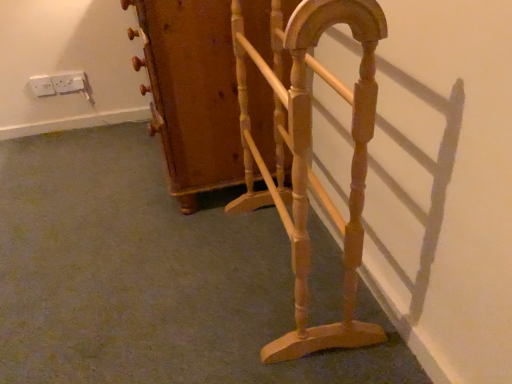
What is the approximate height of light brown wood magazine rack at center, the first furniture when ordered from front to back?

light brown wood magazine rack at center, the first furniture when ordered from front to back, is 29.65 inches in height.

This screenshot has width=512, height=384. What do you see at coordinates (69, 82) in the screenshot?
I see `white plastic socket at upper left, which is the 2th electric outlet in left-to-right order` at bounding box center [69, 82].

What is the approximate width of white plastic socket at upper left, which is the 2th electric outlet in right-to-left order?

0.84 inches.

Describe the element at coordinates (42, 86) in the screenshot. The image size is (512, 384). I see `white plastic socket at upper left, which is the 2th electric outlet in right-to-left order` at that location.

Find the location of a particular element. wooden coat rack at center, the 2th furniture in the front-to-back sequence is located at coordinates (192, 93).

Is light brown wood magazine rack at center, the first furniture when ordered from front to back, at the right side of white plastic socket at upper left, which is the 2th electric outlet in right-to-left order?

Yes, light brown wood magazine rack at center, the first furniture when ordered from front to back, is to the right of white plastic socket at upper left, which is the 2th electric outlet in right-to-left order.

Could you measure the distance between light brown wood magazine rack at center, which is counted as the 2th furniture, starting from the back, and white plastic socket at upper left, which is counted as the first electric outlet, starting from the left?

The distance of light brown wood magazine rack at center, which is counted as the 2th furniture, starting from the back, from white plastic socket at upper left, which is counted as the first electric outlet, starting from the left, is 4.98 feet.

Does light brown wood magazine rack at center, the first furniture when ordered from front to back, have a lesser height compared to white plastic socket at upper left, which is the 2th electric outlet in right-to-left order?

In fact, light brown wood magazine rack at center, the first furniture when ordered from front to back, may be taller than white plastic socket at upper left, which is the 2th electric outlet in right-to-left order.

Is point (296, 55) positioned in front of point (32, 90)?

Yes, point (296, 55) is closer to viewer.

Looking at this image, is light brown wood magazine rack at center, which is counted as the 2th furniture, starting from the back, bigger than wooden coat rack at center, the 2th furniture in the front-to-back sequence?

Actually, light brown wood magazine rack at center, which is counted as the 2th furniture, starting from the back, might be smaller than wooden coat rack at center, the 2th furniture in the front-to-back sequence.

Between point (360, 229) and point (260, 19), which one is positioned in front?

The point (360, 229) is closer to the camera.

Can you confirm if light brown wood magazine rack at center, the first furniture when ordered from front to back, is thinner than wooden coat rack at center, positioned as the 1th furniture in back-to-front order?

Indeed, light brown wood magazine rack at center, the first furniture when ordered from front to back, has a lesser width compared to wooden coat rack at center, positioned as the 1th furniture in back-to-front order.

Can you tell me how much light brown wood magazine rack at center, the first furniture when ordered from front to back, and wooden coat rack at center, the 2th furniture in the front-to-back sequence, differ in facing direction?

The angular difference between light brown wood magazine rack at center, the first furniture when ordered from front to back, and wooden coat rack at center, the 2th furniture in the front-to-back sequence, is 5.45 degrees.

Where is `furniture that is the 2nd one when counting rightward from the white plastic socket at upper left, which is the 2th electric outlet in left-to-right order`? The height and width of the screenshot is (384, 512). furniture that is the 2nd one when counting rightward from the white plastic socket at upper left, which is the 2th electric outlet in left-to-right order is located at coordinates (308, 155).

Looking at this image, is white plastic socket at upper left, the first electric outlet in the right-to-left sequence, positioned with its back to light brown wood magazine rack at center, which is counted as the 2th furniture, starting from the back?

white plastic socket at upper left, the first electric outlet in the right-to-left sequence, is not turned away from light brown wood magazine rack at center, which is counted as the 2th furniture, starting from the back.

Is white plastic socket at upper left, which is the 2th electric outlet in left-to-right order, touching light brown wood magazine rack at center, the first furniture when ordered from front to back?

They are not placed beside each other.

Between white plastic socket at upper left, which is the 2th electric outlet in left-to-right order, and light brown wood magazine rack at center, which is counted as the 2th furniture, starting from the back, which one has larger width?

With larger width is light brown wood magazine rack at center, which is counted as the 2th furniture, starting from the back.

From the image's perspective, is white plastic socket at upper left, which is counted as the first electric outlet, starting from the left, on top of white plastic socket at upper left, the first electric outlet in the right-to-left sequence?

No, from the image's perspective, white plastic socket at upper left, which is counted as the first electric outlet, starting from the left, is not over white plastic socket at upper left, the first electric outlet in the right-to-left sequence.

Consider the image. Would you consider white plastic socket at upper left, which is the 2th electric outlet in right-to-left order, to be distant from white plastic socket at upper left, the first electric outlet in the right-to-left sequence?

That's not correct — white plastic socket at upper left, which is the 2th electric outlet in right-to-left order, is a little close to white plastic socket at upper left, the first electric outlet in the right-to-left sequence.

Between white plastic socket at upper left, which is the 2th electric outlet in right-to-left order, and white plastic socket at upper left, which is the 2th electric outlet in left-to-right order, which one has smaller width?

Thinner between the two is white plastic socket at upper left, which is the 2th electric outlet in right-to-left order.

Does white plastic socket at upper left, which is the 2th electric outlet in left-to-right order, have a smaller size compared to white plastic socket at upper left, which is the 2th electric outlet in right-to-left order?

Actually, white plastic socket at upper left, which is the 2th electric outlet in left-to-right order, might be larger than white plastic socket at upper left, which is the 2th electric outlet in right-to-left order.

Between white plastic socket at upper left, the first electric outlet in the right-to-left sequence, and white plastic socket at upper left, which is counted as the first electric outlet, starting from the left, which one appears on the left side from the viewer's perspective?

From the viewer's perspective, white plastic socket at upper left, which is counted as the first electric outlet, starting from the left, appears more on the left side.

Can you tell me how much white plastic socket at upper left, which is the 2th electric outlet in left-to-right order, and white plastic socket at upper left, which is counted as the first electric outlet, starting from the left, differ in facing direction?

The angle between the facing direction of white plastic socket at upper left, which is the 2th electric outlet in left-to-right order, and the facing direction of white plastic socket at upper left, which is counted as the first electric outlet, starting from the left, is 0.00368 degrees.

In the scene shown: Which is closer, [57,87] or [36,78]?

Clearly, point [57,87] is more distant from the camera than point [36,78].

Is wooden coat rack at center, the 2th furniture in the front-to-back sequence, to the left or to the right of white plastic socket at upper left, the first electric outlet in the right-to-left sequence, in the image?

wooden coat rack at center, the 2th furniture in the front-to-back sequence, is positioned on white plastic socket at upper left, the first electric outlet in the right-to-left sequence,'s right side.

Can you confirm if wooden coat rack at center, the 2th furniture in the front-to-back sequence, is wider than white plastic socket at upper left, the first electric outlet in the right-to-left sequence?

Indeed, wooden coat rack at center, the 2th furniture in the front-to-back sequence, has a greater width compared to white plastic socket at upper left, the first electric outlet in the right-to-left sequence.

Considering the sizes of objects wooden coat rack at center, positioned as the 1th furniture in back-to-front order, and white plastic socket at upper left, the first electric outlet in the right-to-left sequence, in the image provided, who is shorter, wooden coat rack at center, positioned as the 1th furniture in back-to-front order, or white plastic socket at upper left, the first electric outlet in the right-to-left sequence,?

With less height is white plastic socket at upper left, the first electric outlet in the right-to-left sequence.

Which is behind, point (202, 58) or point (76, 74)?

Positioned behind is point (76, 74).

Which point is more forward, (49, 87) or (357, 176)?

The point (357, 176) is more forward.

Is white plastic socket at upper left, which is counted as the first electric outlet, starting from the left, next to light brown wood magazine rack at center, the first furniture when ordered from front to back, and touching it?

No, white plastic socket at upper left, which is counted as the first electric outlet, starting from the left, is not beside light brown wood magazine rack at center, the first furniture when ordered from front to back.

How different are the orientations of white plastic socket at upper left, which is the 2th electric outlet in right-to-left order, and light brown wood magazine rack at center, which is counted as the 2th furniture, starting from the back, in degrees?

The facing directions of white plastic socket at upper left, which is the 2th electric outlet in right-to-left order, and light brown wood magazine rack at center, which is counted as the 2th furniture, starting from the back, are 93.8 degrees apart.

Is white plastic socket at upper left, which is counted as the first electric outlet, starting from the left, facing away from light brown wood magazine rack at center, which is counted as the 2th furniture, starting from the back?

No.

Which furniture is the 2nd one when counting from the right side of the white plastic socket at upper left, which is counted as the first electric outlet, starting from the left? Please provide its 2D coordinates.

[(308, 155)]

This screenshot has width=512, height=384. In order to click on furniture located in front of the wooden coat rack at center, the 2th furniture in the front-to-back sequence in this screenshot , I will do `click(308, 155)`.

From the picture: Based on their spatial positions, is white plastic socket at upper left, which is counted as the first electric outlet, starting from the left, or wooden coat rack at center, positioned as the 1th furniture in back-to-front order, further from white plastic socket at upper left, which is the 2th electric outlet in left-to-right order?

Among the two, wooden coat rack at center, positioned as the 1th furniture in back-to-front order, is located further to white plastic socket at upper left, which is the 2th electric outlet in left-to-right order.

When comparing their distances from white plastic socket at upper left, which is counted as the first electric outlet, starting from the left, does light brown wood magazine rack at center, which is counted as the 2th furniture, starting from the back, or wooden coat rack at center, positioned as the 1th furniture in back-to-front order, seem closer?

Among the two, wooden coat rack at center, positioned as the 1th furniture in back-to-front order, is located nearer to white plastic socket at upper left, which is counted as the first electric outlet, starting from the left.

When comparing their distances from white plastic socket at upper left, which is counted as the first electric outlet, starting from the left, does wooden coat rack at center, positioned as the 1th furniture in back-to-front order, or light brown wood magazine rack at center, the first furniture when ordered from front to back, seem further?

Among the two, light brown wood magazine rack at center, the first furniture when ordered from front to back, is located further to white plastic socket at upper left, which is counted as the first electric outlet, starting from the left.

Looking at the image, which one is located closer to white plastic socket at upper left, which is counted as the first electric outlet, starting from the left, white plastic socket at upper left, which is the 2th electric outlet in left-to-right order, or light brown wood magazine rack at center, the first furniture when ordered from front to back?

white plastic socket at upper left, which is the 2th electric outlet in left-to-right order, is positioned closer to the anchor white plastic socket at upper left, which is counted as the first electric outlet, starting from the left.

Which object lies nearer to the anchor point white plastic socket at upper left, the first electric outlet in the right-to-left sequence, light brown wood magazine rack at center, the first furniture when ordered from front to back, or white plastic socket at upper left, which is counted as the first electric outlet, starting from the left?

white plastic socket at upper left, which is counted as the first electric outlet, starting from the left, is positioned closer to the anchor white plastic socket at upper left, the first electric outlet in the right-to-left sequence.

When comparing their distances from wooden coat rack at center, the 2th furniture in the front-to-back sequence, does white plastic socket at upper left, the first electric outlet in the right-to-left sequence, or white plastic socket at upper left, which is the 2th electric outlet in right-to-left order, seem further?

Among the two, white plastic socket at upper left, which is the 2th electric outlet in right-to-left order, is located further to wooden coat rack at center, the 2th furniture in the front-to-back sequence.

Based on their spatial positions, is wooden coat rack at center, positioned as the 1th furniture in back-to-front order, or white plastic socket at upper left, which is the 2th electric outlet in left-to-right order, further from white plastic socket at upper left, which is the 2th electric outlet in right-to-left order?

The object further to white plastic socket at upper left, which is the 2th electric outlet in right-to-left order, is wooden coat rack at center, positioned as the 1th furniture in back-to-front order.

Looking at the image, which one is located closer to light brown wood magazine rack at center, which is counted as the 2th furniture, starting from the back, wooden coat rack at center, positioned as the 1th furniture in back-to-front order, or white plastic socket at upper left, the first electric outlet in the right-to-left sequence?

The object closer to light brown wood magazine rack at center, which is counted as the 2th furniture, starting from the back, is wooden coat rack at center, positioned as the 1th furniture in back-to-front order.

Identify the location of electric outlet between light brown wood magazine rack at center, the first furniture when ordered from front to back, and white plastic socket at upper left, which is the 2th electric outlet in left-to-right order, in the front-back direction. (42, 86).

Image resolution: width=512 pixels, height=384 pixels. What are the coordinates of `furniture located between light brown wood magazine rack at center, which is counted as the 2th furniture, starting from the back, and white plastic socket at upper left, which is the 2th electric outlet in right-to-left order, in the depth direction` in the screenshot? It's located at (192, 93).

Image resolution: width=512 pixels, height=384 pixels. Identify the location of furniture located between light brown wood magazine rack at center, the first furniture when ordered from front to back, and white plastic socket at upper left, the first electric outlet in the right-to-left sequence, in the depth direction. (192, 93).

Identify the location of electric outlet positioned between wooden coat rack at center, the 2th furniture in the front-to-back sequence, and white plastic socket at upper left, which is the 2th electric outlet in left-to-right order, from near to far. The width and height of the screenshot is (512, 384). (42, 86).